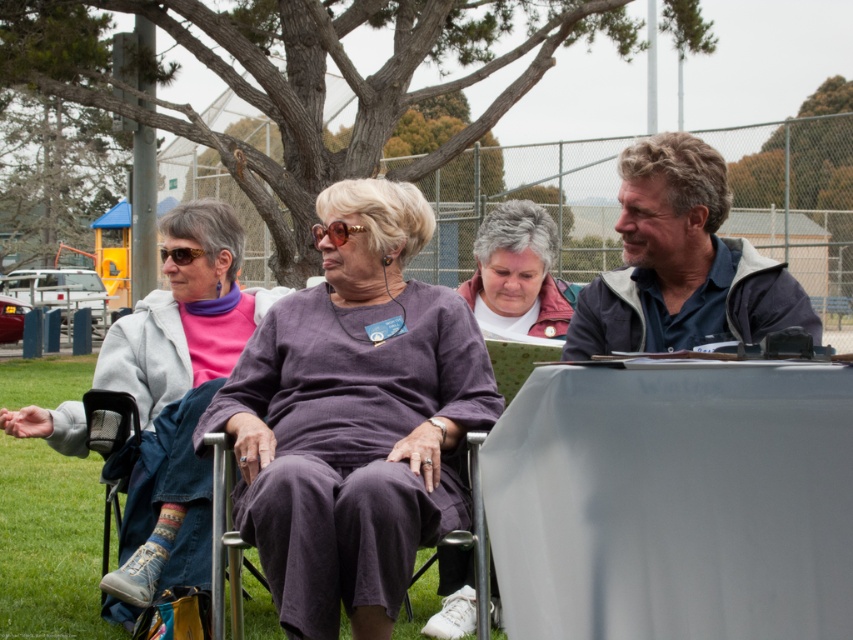
Can you confirm if white cotton shirt at center is smaller than purple fabric chair at center?

No.

Between white cotton shirt at center and purple fabric chair at center, which one is positioned higher?

white cotton shirt at center

Where is `white cotton shirt at center`? The image size is (853, 640). white cotton shirt at center is located at coordinates (518, 275).

Consider the image. Between white cotton shirt at center and white matte jacket at center, which one is positioned lower?

white cotton shirt at center is lower down.

Which is more to the right, white cotton shirt at center or white matte jacket at center?

Positioned to the right is white cotton shirt at center.

Does point (498, 209) come behind point (492, 225)?

Yes, it is behind point (492, 225).

Identify the location of white cotton shirt at center. (518, 275).

Looking at this image, who is more distant from viewer, [364,218] or [791,282]?

The point [364,218] is behind.

I want to click on purple fabric shirt at center, so click(354, 417).

Is point (276, 426) farther from viewer compared to point (700, 294)?

Yes, it is.

Locate an element on the screen. The height and width of the screenshot is (640, 853). purple fabric shirt at center is located at coordinates (354, 417).